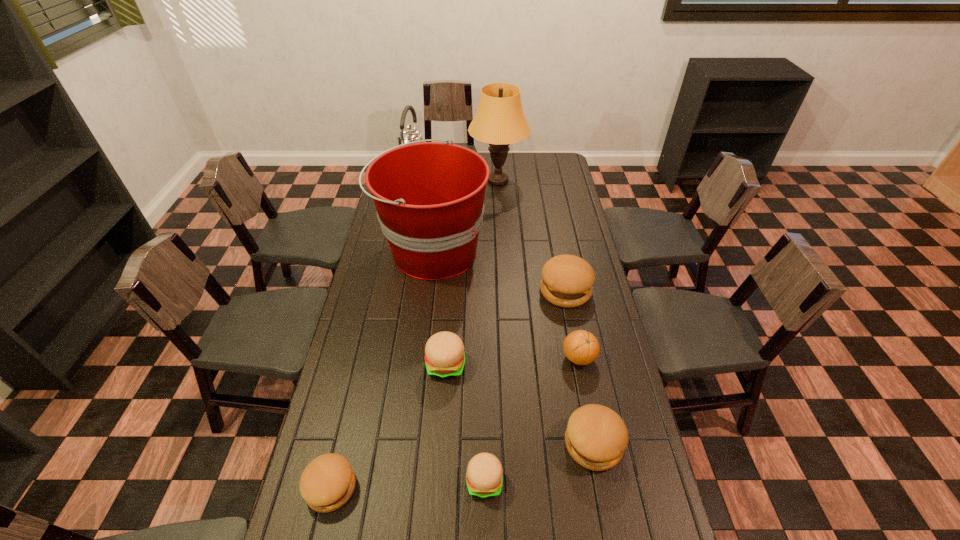
Where is `the leftmost brown hamburger`? This screenshot has width=960, height=540. the leftmost brown hamburger is located at coordinates coord(328,481).

You are a GUI agent. You are given a task and a screenshot of the screen. Output one action in this format:
    pyautogui.click(x=<x>, y=<y>)
    Task: Click on the third hamburger from right to left
    
    Given the screenshot: What is the action you would take?
    pyautogui.click(x=484, y=477)

Where is `the right beige hamburger`? The width and height of the screenshot is (960, 540). the right beige hamburger is located at coordinates (484, 477).

I want to click on vacant space located on the left of the beige lampshade, so click(401, 180).

Locate an element on the screen. The width and height of the screenshot is (960, 540). vacant position located 0.370m on the back of the bucket is located at coordinates (442, 174).

Find the location of a particular element. The width and height of the screenshot is (960, 540). vacant space situated 0.110m on the front of the kettle is located at coordinates (408, 201).

I want to click on free space located 0.300m on the left of the farthest hamburger, so click(460, 291).

At what (x,y) coordinates should I click in order to perform the action: click on free space located on the back of the left beige hamburger. Please return your answer as a coordinate pair (x, y). Looking at the image, I should click on pyautogui.click(x=448, y=334).

You are a GUI agent. You are given a task and a screenshot of the screen. Output one action in this format:
    pyautogui.click(x=<x>, y=<y>)
    Task: Click on the free space located on the front of the orange
    
    Given the screenshot: What is the action you would take?
    pyautogui.click(x=598, y=460)

Image resolution: width=960 pixels, height=540 pixels. What are the coordinates of `free space located 0.070m on the front of the second biggest brown hamburger` in the screenshot? It's located at (604, 501).